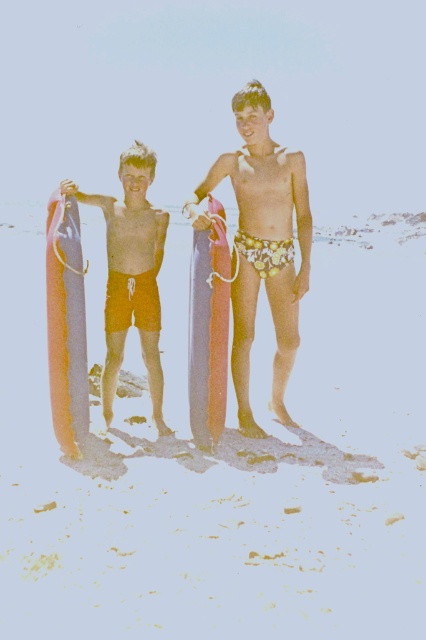
Does floral swim trunks at center have a greater width compared to orange matte shorts at left?

Indeed, floral swim trunks at center has a greater width compared to orange matte shorts at left.

What do you see at coordinates (261, 244) in the screenshot?
I see `floral swim trunks at center` at bounding box center [261, 244].

Is point (233, 288) less distant than point (152, 211)?

Yes, point (233, 288) is in front of point (152, 211).

The image size is (426, 640). What are the coordinates of `floral swim trunks at center` in the screenshot? It's located at (261, 244).

Does point (408, 557) come in front of point (46, 272)?

Yes, it is in front of point (46, 272).

At what (x,y) coordinates should I click in order to perform the action: click on smooth purple surfboard at center. Please return your answer as a coordinate pair (x, y). This screenshot has width=426, height=640. Looking at the image, I should click on (224, 472).

Who is lower down, smooth purple surfboard at center or smooth pink surfboard at center?

smooth pink surfboard at center is lower down.

Measure the distance between smooth purple surfboard at center and smooth pink surfboard at center.

smooth purple surfboard at center and smooth pink surfboard at center are 3.16 meters apart from each other.

Measure the distance between point [244,516] and camera.

A distance of 4.17 meters exists between point [244,516] and camera.

Image resolution: width=426 pixels, height=640 pixels. I want to click on smooth purple surfboard at center, so click(224, 472).